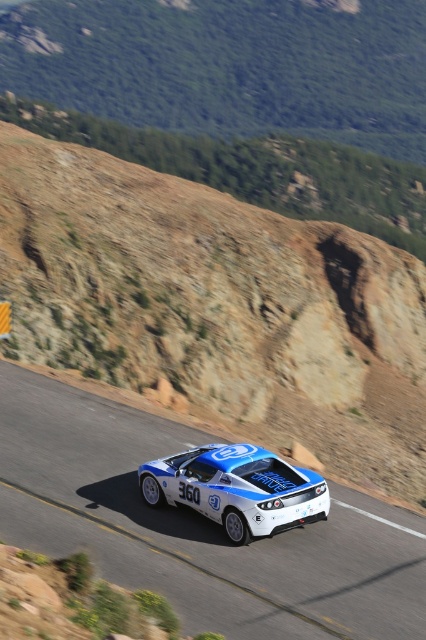
Does white glossy asphalt at center have a greater width compared to shiny blue racing car at center?

Correct, the width of white glossy asphalt at center exceeds that of shiny blue racing car at center.

Is point (195, 612) farther from camera compared to point (253, 525)?

No, it is in front of (253, 525).

Describe the element at coordinates (198, 525) in the screenshot. I see `white glossy asphalt at center` at that location.

The image size is (426, 640). In order to click on white glossy asphalt at center in this screenshot , I will do `click(198, 525)`.